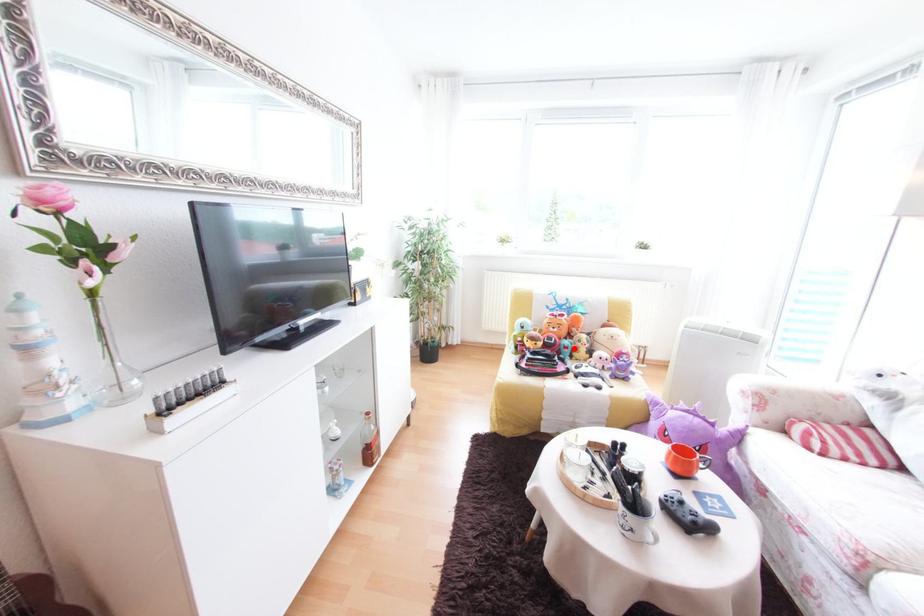
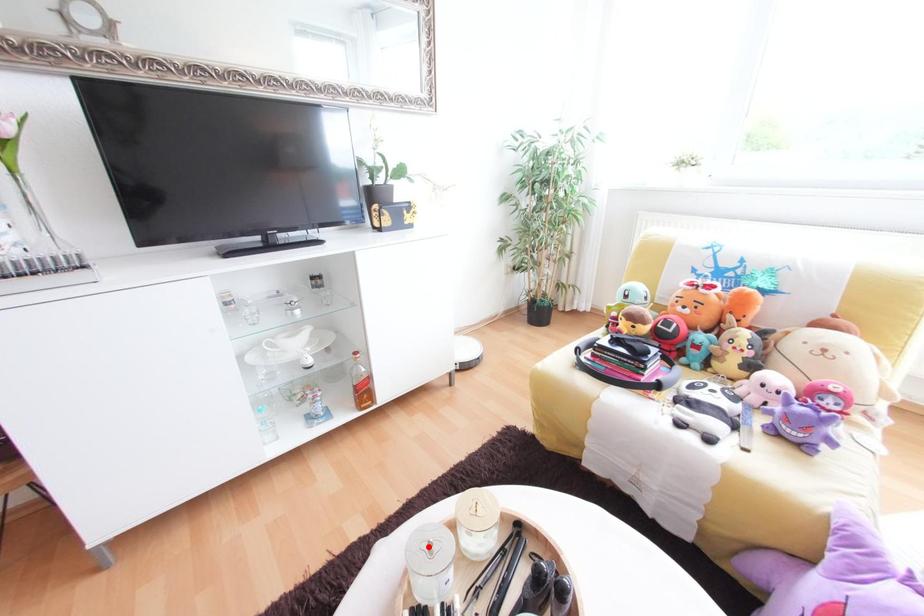
I am providing you with two images of the same scene from different viewpoints. A red point is marked on the first image and another point is marked on the second image. Is the marked point in image1 the same physical position as the marked point in image2?

No